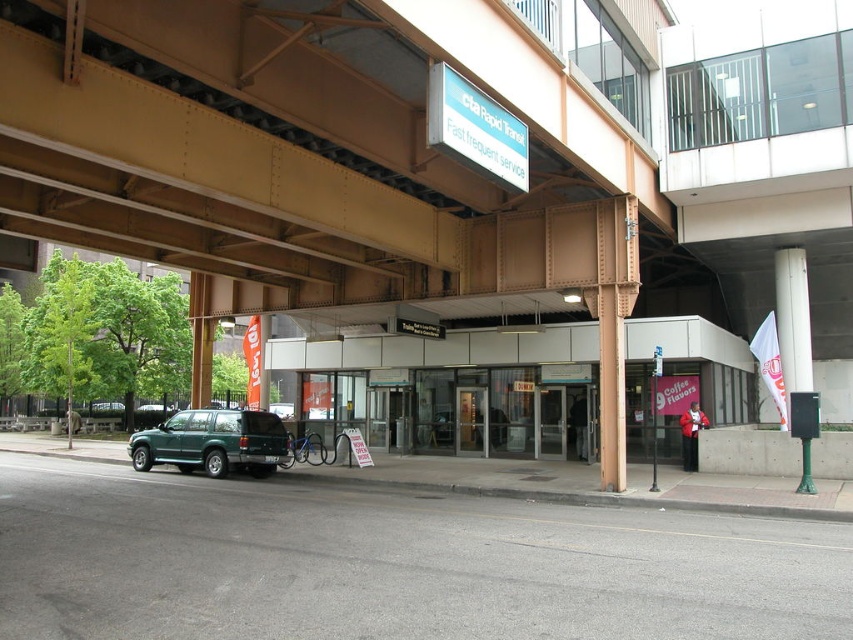
Question: Is metallic gray parking garage at center wider than green matte suv at lower left?

Choices:
 (A) no
 (B) yes

Answer: (B)

Question: Which point is farther to the camera?

Choices:
 (A) (279, 417)
 (B) (260, 120)

Answer: (A)

Question: Does metallic gray parking garage at center have a smaller size compared to green matte suv at lower left?

Choices:
 (A) no
 (B) yes

Answer: (B)

Question: Is metallic brown bridge at upper center closer to camera compared to green matte suv at lower left?

Choices:
 (A) yes
 (B) no

Answer: (A)

Question: Which of the following is the closest to the observer?

Choices:
 (A) (519, 424)
 (B) (366, 10)

Answer: (B)

Question: Among these points, which one is nearest to the camera?

Choices:
 (A) (312, 380)
 (B) (241, 442)

Answer: (B)